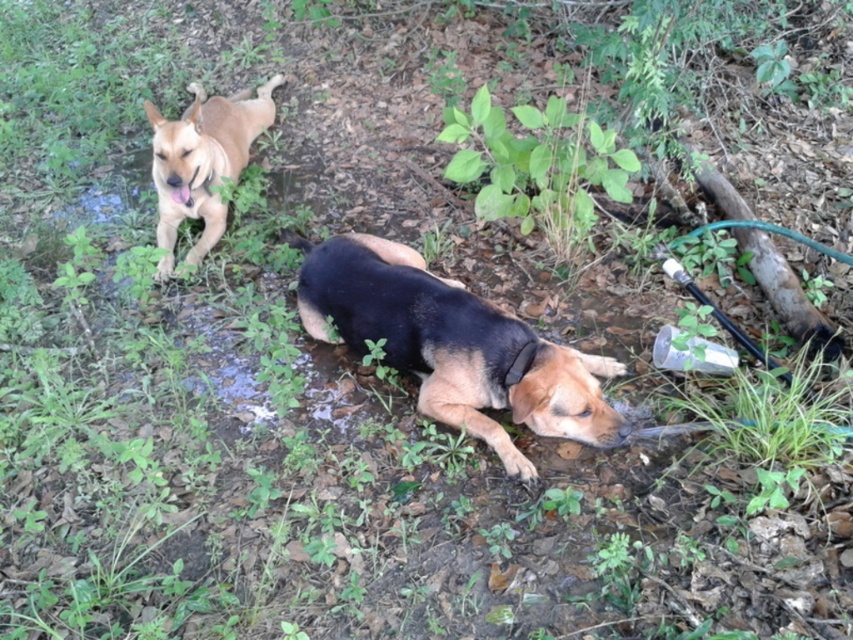
You are standing in the scene and want to pick up an object. There are two points marked in the image, point (502,372) and point (218,131). Which point is closer to you?

Point (502,372) is closer to the camera than point (218,131), so the point closer to you is point (502,372).

Looking at this image, you are a dog owner who wants to know which dog is taller. You see the black smooth dog at center and the light brown fur at upper left. Which dog is taller?

The light brown fur at upper left is taller than the black smooth dog at center.